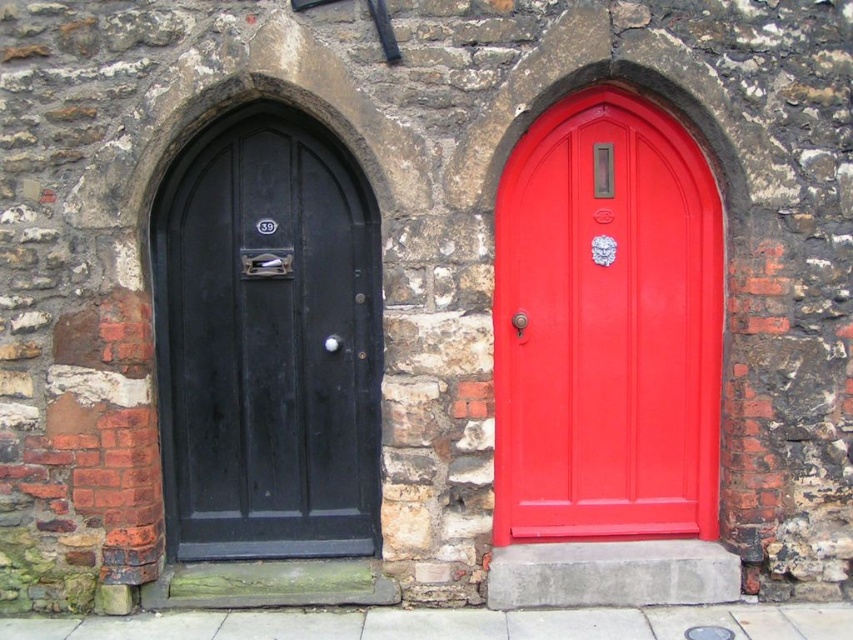
Consider the image. You are a delivery person trying to reach apartment 39. You see the glossy wood door at upper center and the matte black door at left. Which door should you enter to reach apartment 39?

The matte black door at left should be entered to reach apartment 39 because the glossy wood door at upper center is located above it, and the number 39 is likely associated with the lower door.

Based on the photo, you are a delivery person trying to deliver a large package that requires a door width of at least 1 meter. Given that the glossy wood door at upper center and the matte black door at left are both potential entry points, which door should you choose based on their widths?

The glossy wood door at upper center has a greater width than the matte black door at left, so you should choose the glossy wood door at upper center since it meets the required width of at least 1 meter.